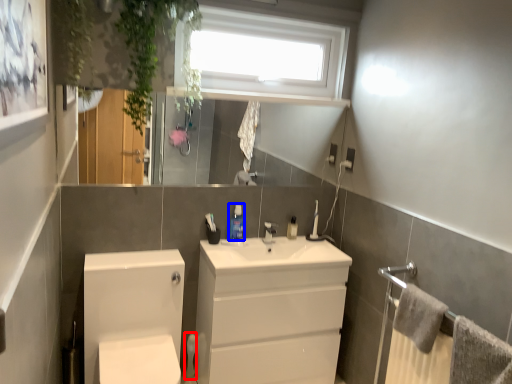
Question: Which point is further to the camera, toilet paper (highlighted by a red box) or toiletry (highlighted by a blue box)?

Choices:
 (A) toilet paper
 (B) toiletry

Answer: (A)